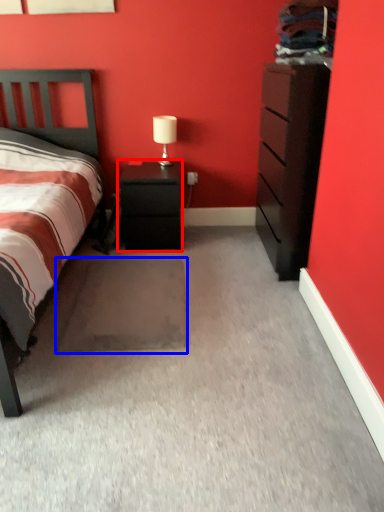
Question: Among these objects, which one is farthest to the camera, nightstand (highlighted by a red box) or footrest (highlighted by a blue box)?

Choices:
 (A) nightstand
 (B) footrest

Answer: (A)